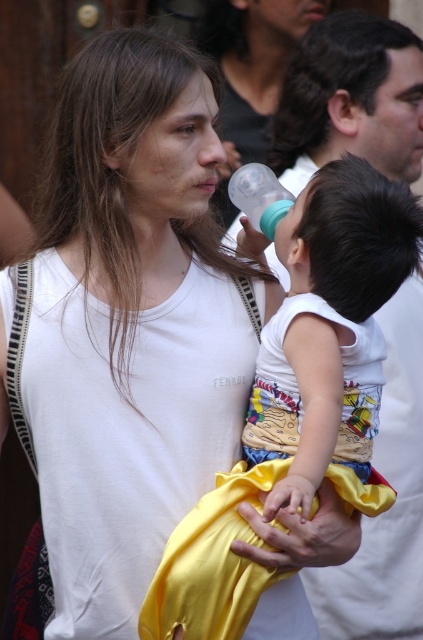
Which of these two, brownhair at center or dark brown hair at upper center, stands shorter?

Standing shorter between the two is dark brown hair at upper center.

Locate an element on the screen. The width and height of the screenshot is (423, 640). brownhair at center is located at coordinates (104, 160).

The height and width of the screenshot is (640, 423). What are the coordinates of `brownhair at center` in the screenshot? It's located at (104, 160).

Between smooth white shirt at center and brownhair at center, which one has less height?

With less height is smooth white shirt at center.

Does smooth white shirt at center have a larger size compared to brownhair at center?

No, smooth white shirt at center is not bigger than brownhair at center.

Does point (392, 164) lie behind point (134, 262)?

Yes, it is behind point (134, 262).

At what (x,y) coordinates should I click in order to perform the action: click on smooth white shirt at center. Please return your answer as a coordinate pair (x, y). The height and width of the screenshot is (640, 423). Looking at the image, I should click on (351, 99).

This screenshot has height=640, width=423. What do you see at coordinates (351, 99) in the screenshot?
I see `smooth white shirt at center` at bounding box center [351, 99].

Which of these two, smooth white shirt at center or dark brown hair at upper center, stands taller?

smooth white shirt at center is taller.

Between point (392, 173) and point (362, 92), which one is positioned behind?

The point (392, 173) is behind.

You are a GUI agent. You are given a task and a screenshot of the screen. Output one action in this format:
    pyautogui.click(x=<x>, y=<y>)
    Task: Click on the smooth white shirt at center
    This screenshot has width=423, height=640.
    Given the screenshot: What is the action you would take?
    pyautogui.click(x=351, y=99)